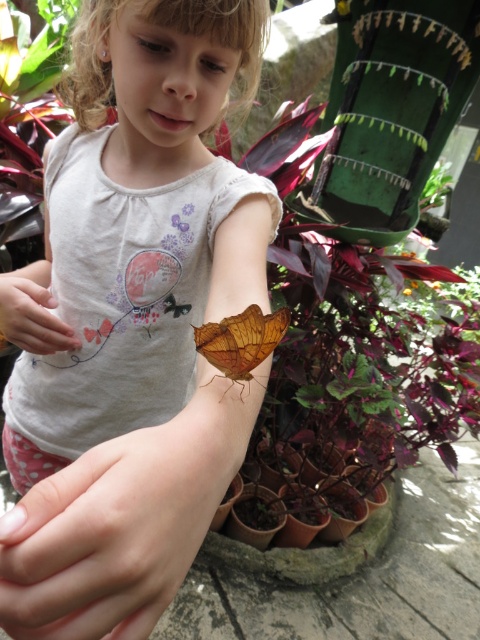
Who is positioned more to the left, matte orange butterfly at upper right or brown matte butterfly at center?

matte orange butterfly at upper right is more to the left.

Is point (124, 572) positioned before point (230, 349)?

Yes, it is.

Identify the location of matte orange butterfly at upper right. (135, 323).

Does brown matte butterfly at center appear on the right side of green leafy plant at upper center?

In fact, brown matte butterfly at center is to the left of green leafy plant at upper center.

Describe the element at coordinates (240, 340) in the screenshot. I see `brown matte butterfly at center` at that location.

The height and width of the screenshot is (640, 480). Identify the location of brown matte butterfly at center. (240, 340).

What do you see at coordinates (106, 541) in the screenshot?
I see `smooth skin at lower center` at bounding box center [106, 541].

Which is behind, point (87, 465) or point (428, 179)?

Point (428, 179)

Between point (36, 552) and point (450, 163), which one is positioned in front?

Point (36, 552) is in front.

Locate an element on the screen. This screenshot has height=640, width=480. smooth skin at lower center is located at coordinates (106, 541).